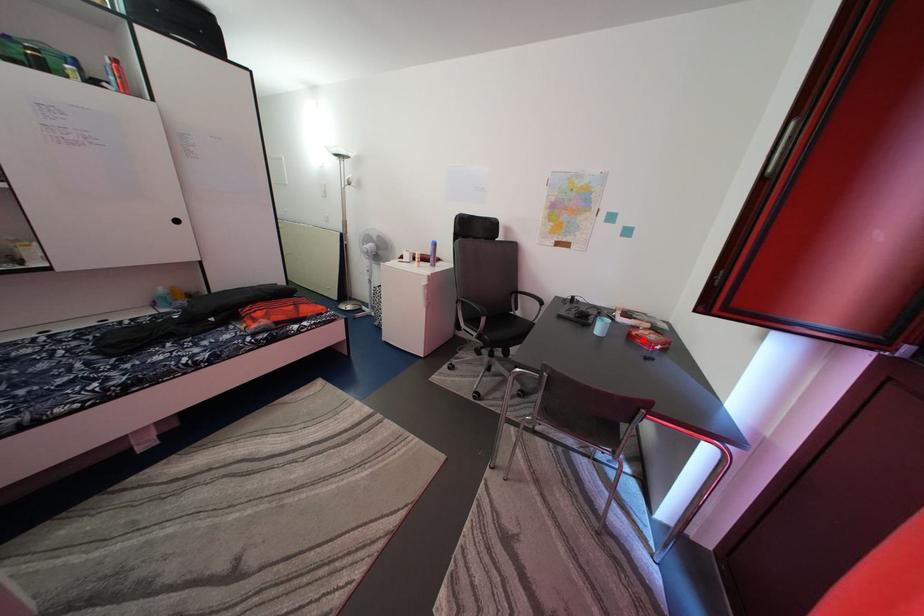
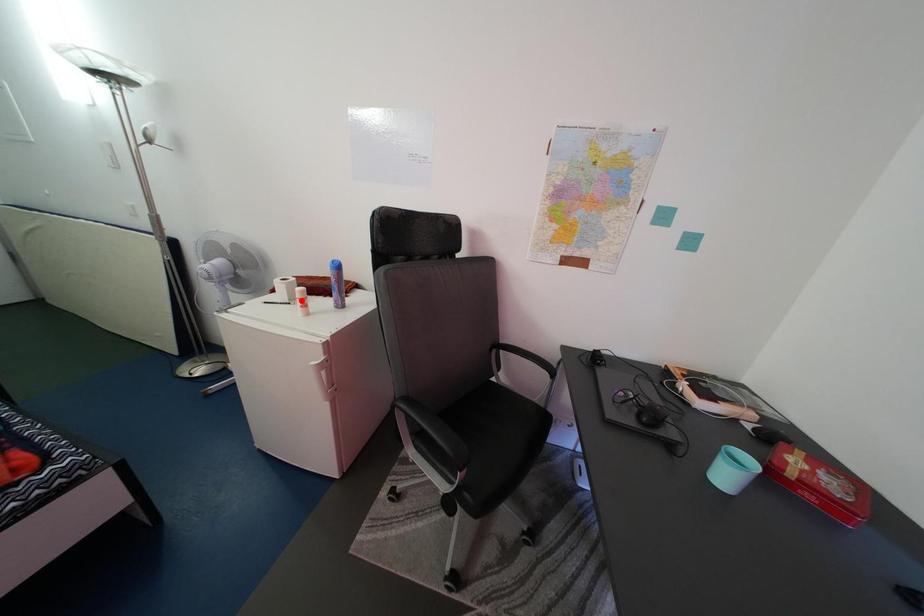
I am providing you with two images of the same scene from different viewpoints. A red point is marked on the first image and another point is marked on the second image. Are the points marked in image1 and image2 representing the same 3D position?

No